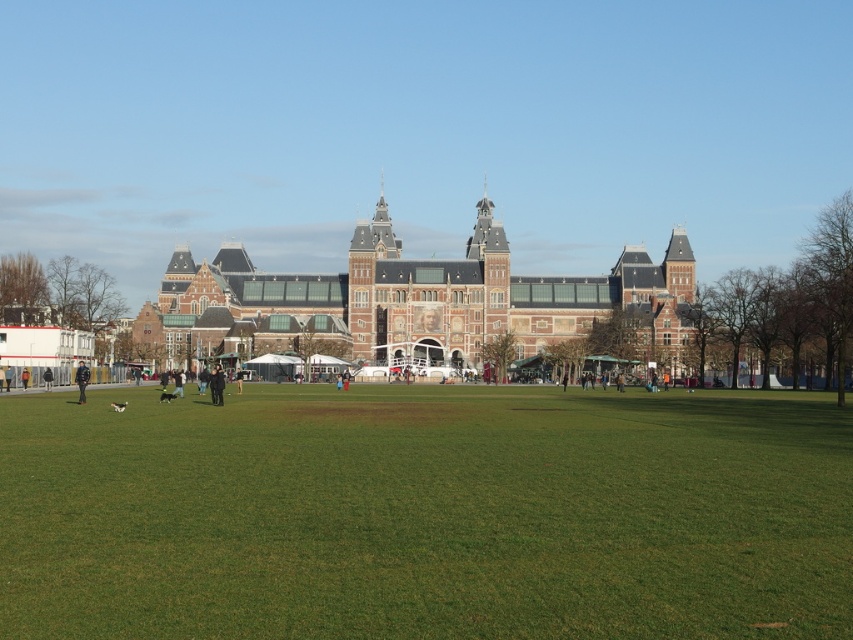
Question: Does green grass at center have a smaller size compared to dark brown leather jacket at center?

Choices:
 (A) yes
 (B) no

Answer: (B)

Question: Which object is farther from the camera taking this photo?

Choices:
 (A) green grass at center
 (B) black leather jacket at lower left
 (C) dark brown leather jacket at center

Answer: (B)

Question: Which object is positioned closest to the green grass at center?

Choices:
 (A) dark brown leather jacket at center
 (B) black leather jacket at lower left

Answer: (A)

Question: Does dark brown leather jacket at center have a larger size compared to black leather jacket at lower left?

Choices:
 (A) no
 (B) yes

Answer: (A)

Question: Which point appears farthest from the camera in this image?

Choices:
 (A) (x=154, y=413)
 (B) (x=85, y=380)

Answer: (B)

Question: Does green grass at center appear on the right side of black leather jacket at lower left?

Choices:
 (A) no
 (B) yes

Answer: (B)